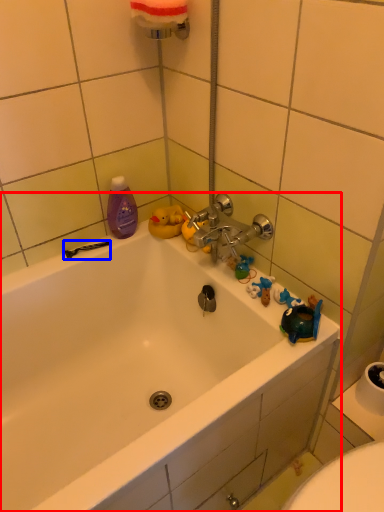
Question: Which object is further to the camera taking this photo, bathtub (highlighted by a red box) or shower (highlighted by a blue box)?

Choices:
 (A) bathtub
 (B) shower

Answer: (B)